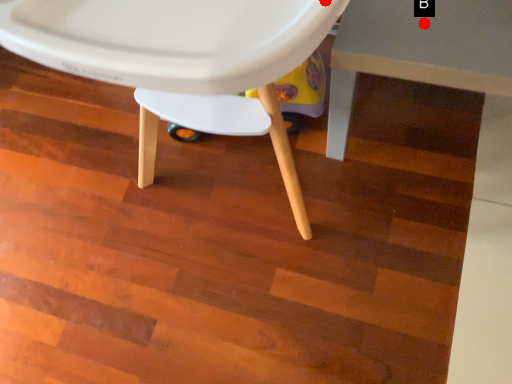
Question: Two points are circled on the image, labeled by A and B beside each circle. Among these points, which one is farthest from the camera?

Choices:
 (A) A is further
 (B) B is further

Answer: (B)